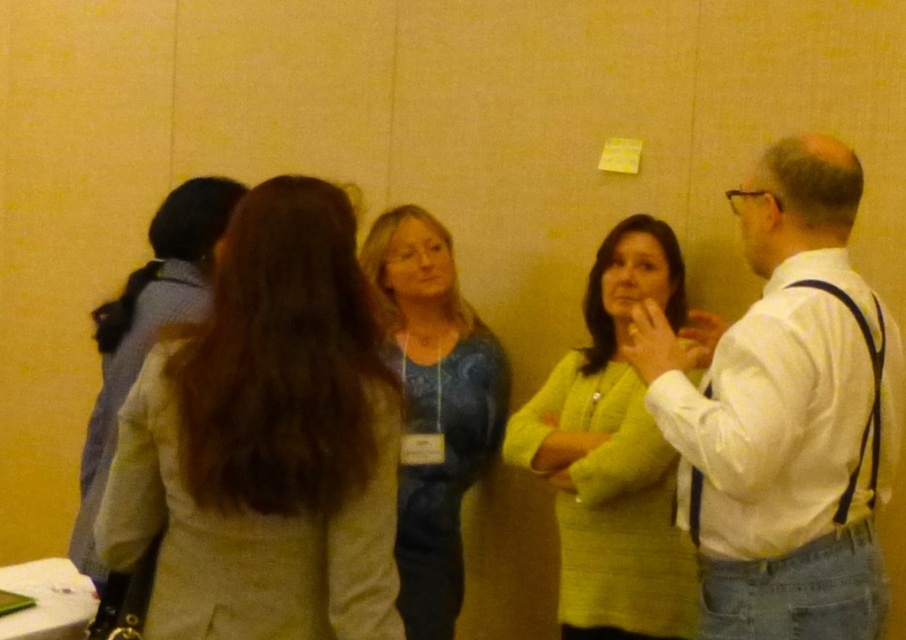
You are organizing a photo shoot and need to arrange two models wearing the light beige fabric coat at center and the matte green sweater at center side by side. Based on the scene, which model should stand on the left to ensure they fit within the frame without overlapping?

The model wearing the light beige fabric coat at center should stand on the left because it might be wider than the matte green sweater at center, allowing for better spacing between them.

You are a photographer trying to capture a candid shot of the two people at the center of the scene. The camera you are using has a minimum focusing distance of 28 inches. Can you take a clear photo of both the white shirt at center and the blue textured sweater at center without them overlapping in the frame?

The white shirt at center and blue textured sweater at center are 31.03 inches apart from each other. Since this distance is greater than the camera minimum focusing distance of 28 inches, you can take a clear photo of both without them overlapping in the frame.